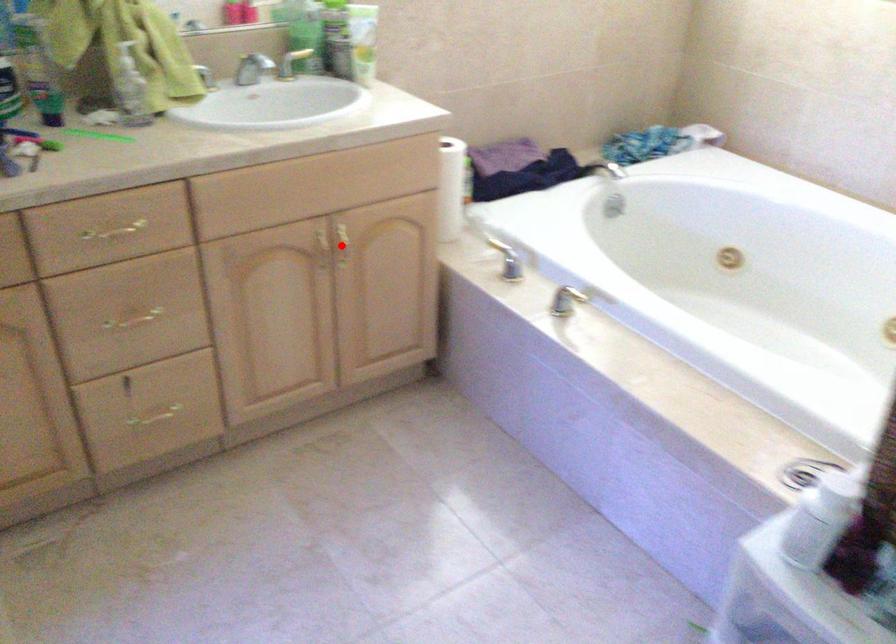
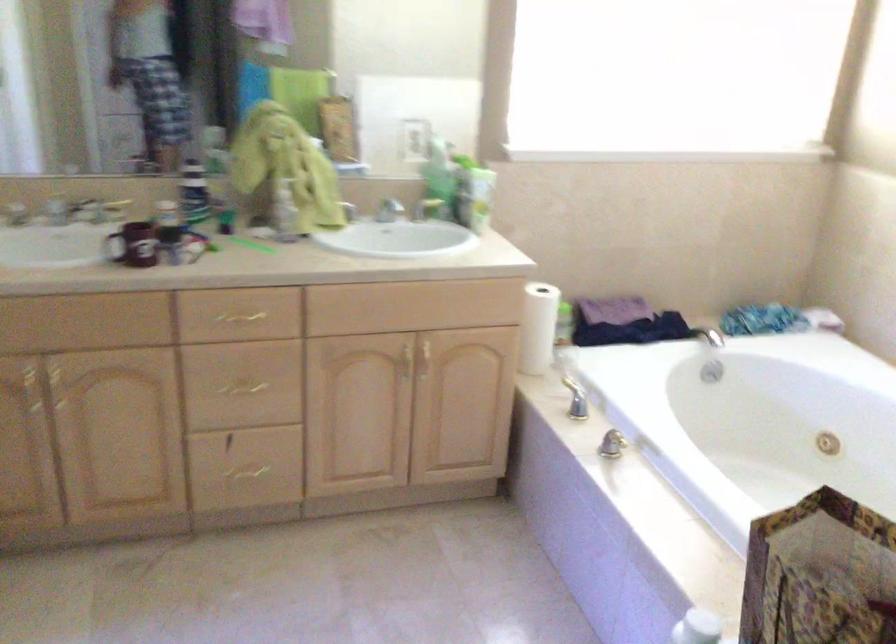
Question: A red point is marked in image1. In image2, is the corresponding 3D point closer to the camera or farther? Reply with the corresponding letter.

Choices:
 (A) The corresponding 3D point is closer.
 (B) The corresponding 3D point is farther.

Answer: (B)